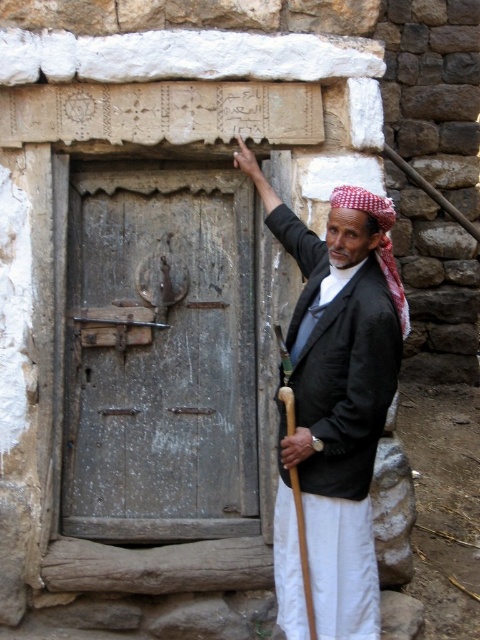
Does weathered wood door at center have a lesser width compared to black woolen jacket at center?

No, weathered wood door at center is not thinner than black woolen jacket at center.

Which is in front, point (145, 513) or point (386, 406)?

Positioned in front is point (386, 406).

I want to click on weathered wood door at center, so click(x=160, y=356).